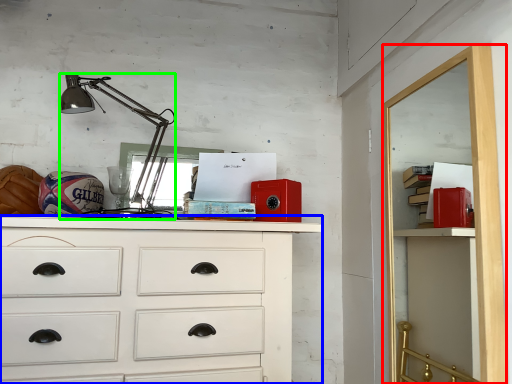
Question: Estimate the real-world distances between objects in this image. Which object is closer to file cabinet (highlighted by a red box), chest of drawers (highlighted by a blue box) or lamp (highlighted by a green box)?

Choices:
 (A) chest of drawers
 (B) lamp

Answer: (A)